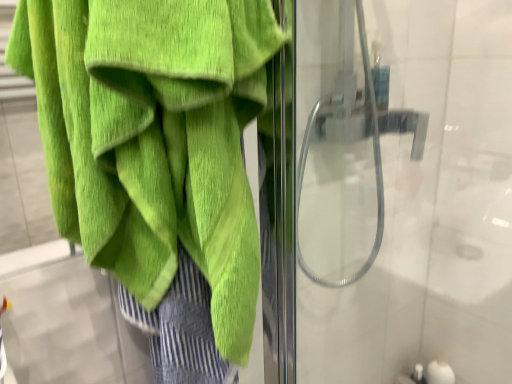
This screenshot has height=384, width=512. What are the coordinates of `green terry cloth towel at left` in the screenshot? It's located at point(154,138).

This screenshot has height=384, width=512. Describe the element at coordinates (154, 138) in the screenshot. I see `green terry cloth towel at left` at that location.

Measure the distance between point (112, 35) and camera.

A distance of 16.02 inches exists between point (112, 35) and camera.

In order to face transparent glass shower door at right, should I rotate leftwards or rightwards?

Turn right by 23.533 degrees to look at transparent glass shower door at right.

At what (x,y) coordinates should I click in order to perform the action: click on transparent glass shower door at right. Please return your answer as a coordinate pair (x, y). This screenshot has width=512, height=384. Looking at the image, I should click on (404, 189).

Measure the distance between transparent glass shower door at right and camera.

The depth of transparent glass shower door at right is 70.41 centimeters.

The image size is (512, 384). What do you see at coordinates (404, 189) in the screenshot?
I see `transparent glass shower door at right` at bounding box center [404, 189].

The height and width of the screenshot is (384, 512). Find the location of `green terry cloth towel at left`. green terry cloth towel at left is located at coordinates (154, 138).

In the image, is green terry cloth towel at left on the left side or the right side of transparent glass shower door at right?

In the image, green terry cloth towel at left appears on the left side of transparent glass shower door at right.

Is green terry cloth towel at left positioned behind transparent glass shower door at right?

No, it is not.

Which is farther from the camera, (121, 17) or (429, 146)?

Positioned behind is point (429, 146).

From the image's perspective, which one is positioned higher, green terry cloth towel at left or transparent glass shower door at right?

transparent glass shower door at right, from the image's perspective.

From a real-world perspective, who is located higher, green terry cloth towel at left or transparent glass shower door at right?

green terry cloth towel at left is physically above.

Considering the sizes of objects green terry cloth towel at left and transparent glass shower door at right in the image provided, who is wider, green terry cloth towel at left or transparent glass shower door at right?

transparent glass shower door at right is wider.

In terms of height, does green terry cloth towel at left look taller or shorter compared to transparent glass shower door at right?

Clearly, green terry cloth towel at left is shorter compared to transparent glass shower door at right.

Considering the sizes of objects green terry cloth towel at left and transparent glass shower door at right in the image provided, who is smaller, green terry cloth towel at left or transparent glass shower door at right?

Smaller between the two is green terry cloth towel at left.

In the scene shown: Can we say green terry cloth towel at left lies outside transparent glass shower door at right?

green terry cloth towel at left is positioned outside transparent glass shower door at right.

Is green terry cloth towel at left with transparent glass shower door at right?

No.

Is green terry cloth towel at left aimed at transparent glass shower door at right?

No, green terry cloth towel at left is not turned towards transparent glass shower door at right.

I want to click on towel that appears in front of the transparent glass shower door at right, so click(x=154, y=138).

Visually, is transparent glass shower door at right positioned to the left or to the right of green terry cloth towel at left?

Based on their positions, transparent glass shower door at right is located to the right of green terry cloth towel at left.

Considering their positions, is transparent glass shower door at right located in front of or behind green terry cloth towel at left?

Answer: Clearly, transparent glass shower door at right is behind green terry cloth towel at left.

Looking at this image, which is nearer, (388, 14) or (113, 97)?

Point (388, 14) is positioned farther from the camera compared to point (113, 97).

From the image's perspective, which object appears higher, transparent glass shower door at right or green terry cloth towel at left?

From the image's view, transparent glass shower door at right is above.

From a real-world perspective, between transparent glass shower door at right and green terry cloth towel at left, who is vertically lower?

transparent glass shower door at right, from a real-world perspective.

Between transparent glass shower door at right and green terry cloth towel at left, which one has larger width?

Wider between the two is transparent glass shower door at right.

Does transparent glass shower door at right have a greater height compared to green terry cloth towel at left?

Indeed, transparent glass shower door at right has a greater height compared to green terry cloth towel at left.

Who is smaller, transparent glass shower door at right or green terry cloth towel at left?

green terry cloth towel at left is smaller.

Is green terry cloth towel at left surrounded by transparent glass shower door at right?

No, transparent glass shower door at right does not contain green terry cloth towel at left.

Is transparent glass shower door at right beside green terry cloth towel at left?

No, transparent glass shower door at right is not in contact with green terry cloth towel at left.

Is transparent glass shower door at right oriented towards green terry cloth towel at left?

No, transparent glass shower door at right does not turn towards green terry cloth towel at left.

What's the angular difference between transparent glass shower door at right and green terry cloth towel at left's facing directions?

transparent glass shower door at right and green terry cloth towel at left are facing 2.16 degrees away from each other.

How distant is transparent glass shower door at right from green terry cloth towel at left?

The distance of transparent glass shower door at right from green terry cloth towel at left is 55.76 centimeters.

There is a transparent glass shower door at right. Identify the location of towel above it (from a real-world perspective). (154, 138).

Where is `towel in front of the transparent glass shower door at right`? This screenshot has width=512, height=384. towel in front of the transparent glass shower door at right is located at coordinates (154, 138).

At what (x,y) coordinates should I click in order to perform the action: click on towel on the left of transparent glass shower door at right. Please return your answer as a coordinate pair (x, y). Looking at the image, I should click on (154, 138).